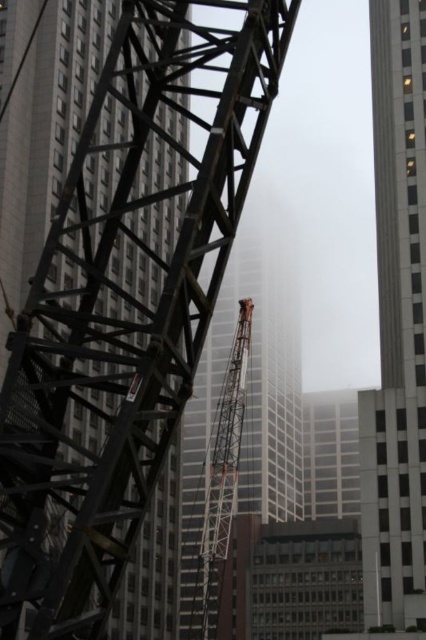
Question: Can you confirm if white glass skyscraper at right is wider than orange metallic crane at center?

Choices:
 (A) yes
 (B) no

Answer: (B)

Question: In this image, where is metallic scaffolding at left located relative to white glass skyscraper at right?

Choices:
 (A) below
 (B) above

Answer: (A)

Question: Which is nearer to the orange metallic crane at center?

Choices:
 (A) metallic scaffolding at left
 (B) white glass skyscraper at right

Answer: (A)

Question: Based on their relative distances, which object is nearer to the white glass skyscraper at right?

Choices:
 (A) metallic scaffolding at left
 (B) orange metallic crane at center

Answer: (A)

Question: Estimate the real-world distances between objects in this image. Which object is farther from the white glass skyscraper at right?

Choices:
 (A) metallic scaffolding at left
 (B) orange metallic crane at center

Answer: (B)

Question: Is white glass skyscraper at right smaller than orange metallic crane at center?

Choices:
 (A) yes
 (B) no

Answer: (A)